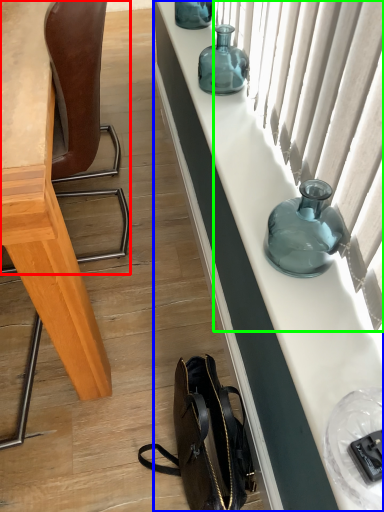
Question: Which object is the farthest from chair (highlighted by a red box)? Choose among these: cabinetry (highlighted by a blue box) or curtain (highlighted by a green box).

Choices:
 (A) cabinetry
 (B) curtain

Answer: (B)